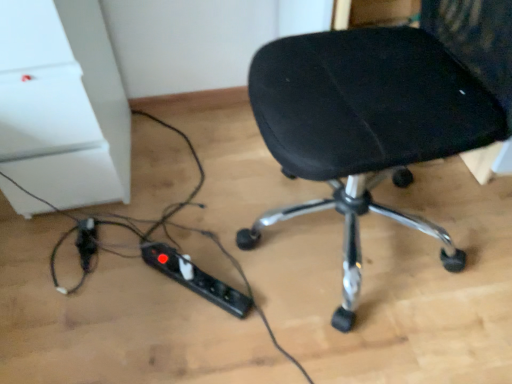
Question: Can you confirm if black plastic extension cord at lower center, acting as the 1th extension cord starting from the right, is wider than black fabric chair at center?

Choices:
 (A) no
 (B) yes

Answer: (A)

Question: Does black plastic extension cord at lower center, the second extension cord when ordered from left to right, lie in front of black fabric chair at center?

Choices:
 (A) no
 (B) yes

Answer: (A)

Question: Is black plastic extension cord at lower center, acting as the 1th extension cord starting from the right, smaller than black fabric chair at center?

Choices:
 (A) no
 (B) yes

Answer: (B)

Question: From the image's perspective, does black plastic extension cord at lower center, the second extension cord when ordered from left to right, appear higher than black fabric chair at center?

Choices:
 (A) yes
 (B) no

Answer: (B)

Question: Does black plastic extension cord at lower center, the second extension cord when ordered from left to right, touch black fabric chair at center?

Choices:
 (A) yes
 (B) no

Answer: (B)

Question: From a real-world perspective, is black plastic extension cord at lower center, the second extension cord when ordered from left to right, under black fabric chair at center?

Choices:
 (A) no
 (B) yes

Answer: (B)

Question: Is black plastic extension cord at lower left, which appears as the 2th extension cord when viewed from the right, facing away from black fabric chair at center?

Choices:
 (A) yes
 (B) no

Answer: (B)

Question: From the image's perspective, does black plastic extension cord at lower left, which appears as the first extension cord when viewed from the left, appear higher than black fabric chair at center?

Choices:
 (A) no
 (B) yes

Answer: (A)

Question: Is black plastic extension cord at lower left, which appears as the first extension cord when viewed from the left, beside black fabric chair at center?

Choices:
 (A) no
 (B) yes

Answer: (A)

Question: Is black plastic extension cord at lower left, which appears as the 2th extension cord when viewed from the right, further to camera compared to black fabric chair at center?

Choices:
 (A) yes
 (B) no

Answer: (A)

Question: From a real-world perspective, is black plastic extension cord at lower left, which appears as the first extension cord when viewed from the left, under black fabric chair at center?

Choices:
 (A) no
 (B) yes

Answer: (B)

Question: Is there a large distance between black plastic extension cord at lower left, which appears as the first extension cord when viewed from the left, and black fabric chair at center?

Choices:
 (A) no
 (B) yes

Answer: (A)

Question: Is black plastic extension cord at lower center, acting as the 1th extension cord starting from the right, surrounded by black plastic extension cord at lower left, which appears as the 2th extension cord when viewed from the right?

Choices:
 (A) yes
 (B) no

Answer: (B)